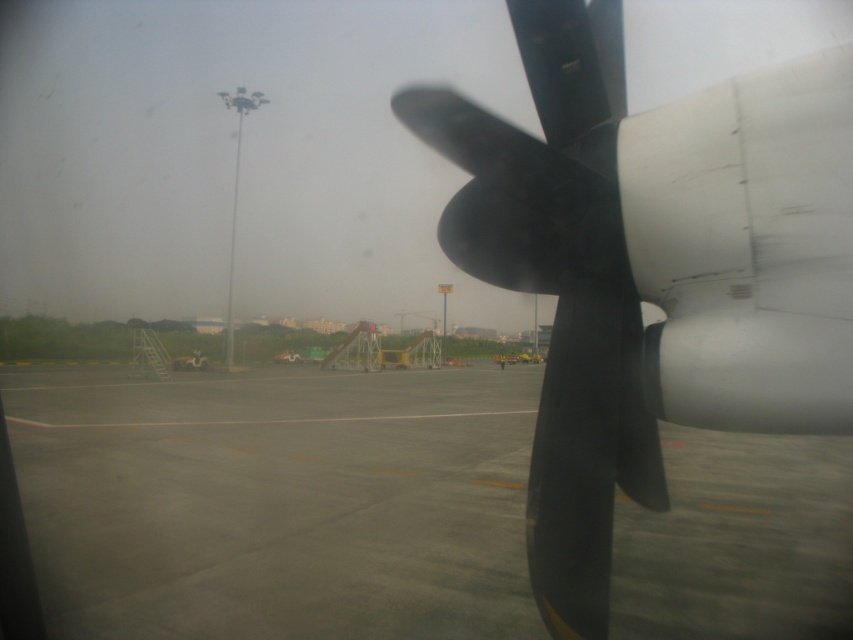
Question: Which point is farther from the camera taking this photo?

Choices:
 (A) (119, 604)
 (B) (552, 122)

Answer: (A)

Question: Which of the following is the farthest from the observer?

Choices:
 (A) (614, 141)
 (B) (485, 616)

Answer: (B)

Question: Which point appears farthest from the camera in this image?

Choices:
 (A) (91, 460)
 (B) (590, 154)

Answer: (A)

Question: Does gray concrete runway at center appear under matte black propeller at center?

Choices:
 (A) no
 (B) yes

Answer: (B)

Question: Where is gray concrete runway at center located in relation to matte black propeller at center in the image?

Choices:
 (A) above
 (B) below

Answer: (B)

Question: From the image, what is the correct spatial relationship of gray concrete runway at center in relation to matte black propeller at center?

Choices:
 (A) left
 (B) right

Answer: (A)